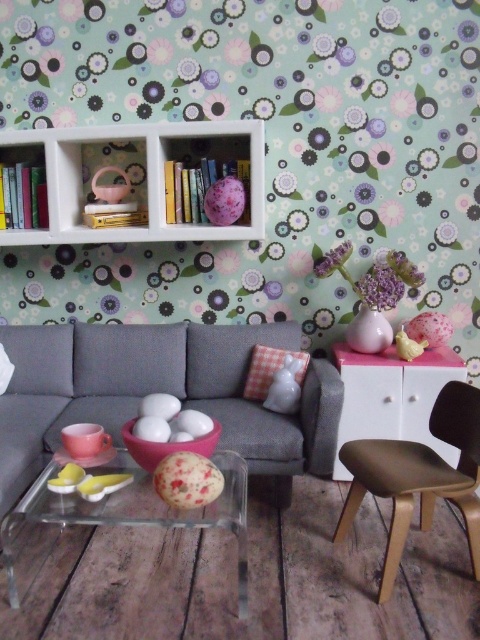
Does pink glossy cabinet at right appear on the left side of purple matte flower at upper center?

Incorrect, pink glossy cabinet at right is not on the left side of purple matte flower at upper center.

You are a GUI agent. You are given a task and a screenshot of the screen. Output one action in this format:
    pyautogui.click(x=<x>, y=<y>)
    Task: Click on the pink glossy cabinet at right
    The height and width of the screenshot is (640, 480).
    Given the screenshot: What is the action you would take?
    pyautogui.click(x=393, y=397)

Between transparent acrylic glass table at lower center and pink glossy cabinet at right, which one is positioned higher?

pink glossy cabinet at right

The height and width of the screenshot is (640, 480). What do you see at coordinates (117, 516) in the screenshot?
I see `transparent acrylic glass table at lower center` at bounding box center [117, 516].

This screenshot has height=640, width=480. I want to click on transparent acrylic glass table at lower center, so click(117, 516).

What are the coordinates of `transparent acrylic glass table at lower center` in the screenshot? It's located at (117, 516).

Does matte pink plastic basket at upper left have a lesser width compared to checkered fabric pillow at center?

In fact, matte pink plastic basket at upper left might be wider than checkered fabric pillow at center.

Describe the element at coordinates (101, 180) in the screenshot. I see `matte pink plastic basket at upper left` at that location.

Where is `matte pink plastic basket at upper left`? The image size is (480, 640). matte pink plastic basket at upper left is located at coordinates (101, 180).

Where is `matte pink plastic basket at upper left`? matte pink plastic basket at upper left is located at coordinates (101, 180).